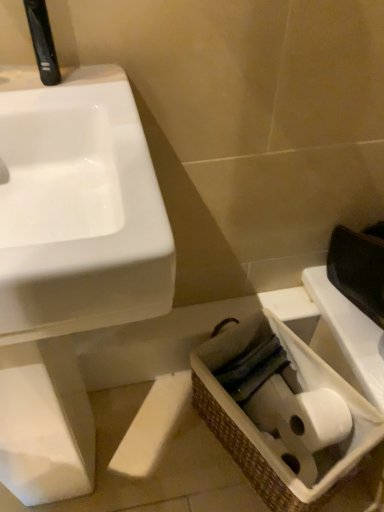
The width and height of the screenshot is (384, 512). What do you see at coordinates (78, 207) in the screenshot?
I see `white glossy sink at left` at bounding box center [78, 207].

At what (x,y) coordinates should I click in order to perform the action: click on woven brown basket at lower right. Please return your answer as a coordinate pair (x, y). This screenshot has height=512, width=384. Looking at the image, I should click on tap(282, 413).

Identify the location of black plastic faucet at upper left. (42, 41).

Where is `white glossy sink at left`? This screenshot has height=512, width=384. white glossy sink at left is located at coordinates (78, 207).

From a real-world perspective, is woven brown basket at lower right over white glossy sink at left?

No.

Is woven brown basket at lower right wider than white glossy sink at left?

No, woven brown basket at lower right is not wider than white glossy sink at left.

From the image's perspective, is woven brown basket at lower right positioned above or below white glossy sink at left?

Based on their image positions, woven brown basket at lower right is located beneath white glossy sink at left.

From a real-world perspective, is black plastic faucet at upper left on top of white glossy sink at left?

Yes, from a real-world perspective, black plastic faucet at upper left is above white glossy sink at left.

How distant is black plastic faucet at upper left from white glossy sink at left?

The distance of black plastic faucet at upper left from white glossy sink at left is 19.99 centimeters.

The height and width of the screenshot is (512, 384). Find the location of `sink located on the left of black plastic faucet at upper left`. sink located on the left of black plastic faucet at upper left is located at coordinates (78, 207).

Is point (44, 35) positioned behind point (66, 148)?

No, it is in front of (66, 148).

Measure the distance from black plastic faucet at upper left to woven brown basket at lower right.

74.68 centimeters.

Could you tell me if black plastic faucet at upper left is turned towards woven brown basket at lower right?

No, black plastic faucet at upper left is not turned towards woven brown basket at lower right.

Which is correct: black plastic faucet at upper left is inside woven brown basket at lower right, or outside of it?

black plastic faucet at upper left is spatially situated outside woven brown basket at lower right.

Does point (44, 67) lie behind point (298, 484)?

No, (44, 67) is closer to viewer.

Is white glossy sink at left situated inside woven brown basket at lower right or outside?

white glossy sink at left cannot be found inside woven brown basket at lower right.

Is point (48, 120) farther from camera compared to point (347, 453)?

No, it is in front of (347, 453).

Based on the photo, how many degrees apart are the facing directions of white glossy sink at left and woven brown basket at lower right?

white glossy sink at left and woven brown basket at lower right are facing 65.2 degrees away from each other.

Considering the relative positions of white glossy sink at left and woven brown basket at lower right in the image provided, is white glossy sink at left to the right of woven brown basket at lower right from the viewer's perspective?

Incorrect, white glossy sink at left is not on the right side of woven brown basket at lower right.

How many degrees apart are the facing directions of white glossy sink at left and black plastic faucet at upper left?

The angular difference between white glossy sink at left and black plastic faucet at upper left is 6.84 degrees.

Is white glossy sink at left touching black plastic faucet at upper left?

No.

Can you confirm if white glossy sink at left is positioned to the left of black plastic faucet at upper left?

Yes.

Is white glossy sink at left located outside black plastic faucet at upper left?

Yes, white glossy sink at left is located beyond the bounds of black plastic faucet at upper left.

Measure the distance between woven brown basket at lower right and black plastic faucet at upper left.

The distance of woven brown basket at lower right from black plastic faucet at upper left is 74.68 centimeters.

Would you consider woven brown basket at lower right to be distant from black plastic faucet at upper left?

They are positioned close to each other.

Which is more to the right, woven brown basket at lower right or black plastic faucet at upper left?

Positioned to the right is woven brown basket at lower right.

From a real-world perspective, is woven brown basket at lower right positioned above or below black plastic faucet at upper left?

In terms of real-world spatial position, woven brown basket at lower right is below black plastic faucet at upper left.

You are a GUI agent. You are given a task and a screenshot of the screen. Output one action in this format:
    pyautogui.click(x=<x>, y=<y>)
    Task: Click on the basket located underneath the white glossy sink at left (from a real-world perspective)
    
    Given the screenshot: What is the action you would take?
    pyautogui.click(x=282, y=413)

Image resolution: width=384 pixels, height=512 pixels. I want to click on sink that is on the left side of black plastic faucet at upper left, so click(78, 207).

From the image, which object appears to be nearer to woven brown basket at lower right, white glossy sink at left or black plastic faucet at upper left?

Among the two, white glossy sink at left is located nearer to woven brown basket at lower right.

Considering their positions, is woven brown basket at lower right positioned closer to black plastic faucet at upper left than white glossy sink at left?

Among the two, white glossy sink at left is located nearer to black plastic faucet at upper left.

Which object lies further to the anchor point white glossy sink at left, black plastic faucet at upper left or woven brown basket at lower right?

Among the two, woven brown basket at lower right is located further to white glossy sink at left.

Which object lies further to the anchor point black plastic faucet at upper left, white glossy sink at left or woven brown basket at lower right?

The object further to black plastic faucet at upper left is woven brown basket at lower right.

Considering their positions, is woven brown basket at lower right positioned further to white glossy sink at left than black plastic faucet at upper left?

Among the two, woven brown basket at lower right is located further to white glossy sink at left.

From the image, which object appears to be farther from woven brown basket at lower right, black plastic faucet at upper left or white glossy sink at left?

black plastic faucet at upper left is positioned further to the anchor woven brown basket at lower right.

Where is `sink that lies between black plastic faucet at upper left and woven brown basket at lower right from top to bottom`? sink that lies between black plastic faucet at upper left and woven brown basket at lower right from top to bottom is located at coordinates (78, 207).